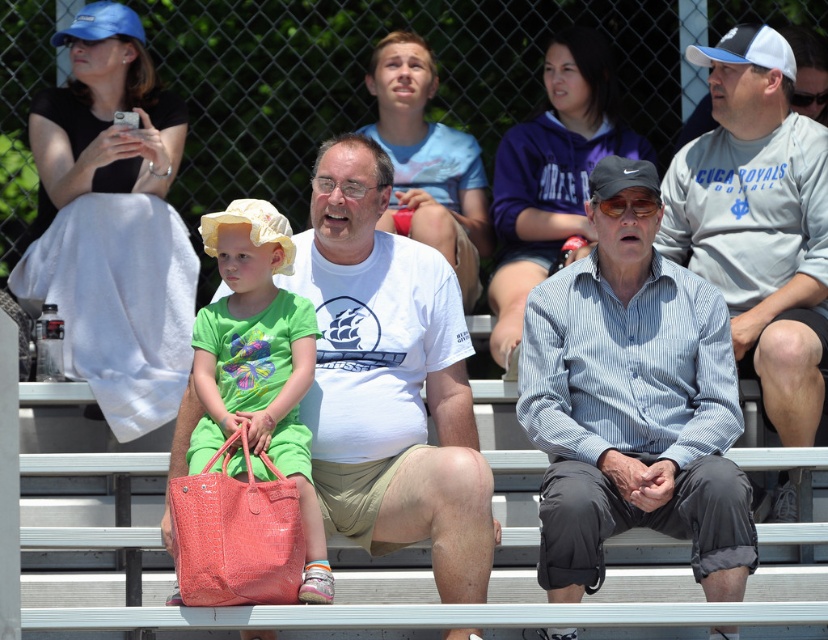
Question: Which object is farther from the camera taking this photo?

Choices:
 (A) white matte shirt at center
 (B) coral crocodile-patterned handbag at center
 (C) matte pink crocodile-patterned handbag at center
 (D) gray cotton shirt at center

Answer: (D)

Question: Observing the image, what is the correct spatial positioning of striped cotton shirt at center in reference to gray cotton shirt at center?

Choices:
 (A) below
 (B) above

Answer: (A)

Question: Which is farther from the gray cotton shirt at center?

Choices:
 (A) white matte shirt at center
 (B) coral crocodile-patterned handbag at center
 (C) striped cotton shirt at center
 (D) matte pink crocodile-patterned handbag at center

Answer: (B)

Question: Is white matte shirt at center smaller than gray cotton shirt at center?

Choices:
 (A) no
 (B) yes

Answer: (A)

Question: Is striped cotton shirt at center below gray cotton shirt at center?

Choices:
 (A) yes
 (B) no

Answer: (A)

Question: Which of the following is the farthest from the observer?

Choices:
 (A) (711, 198)
 (B) (210, 582)

Answer: (A)